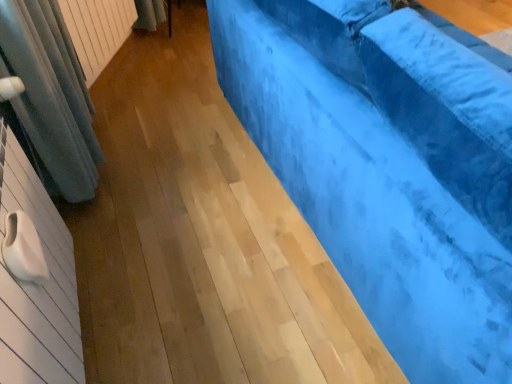
Question: Is point (79, 4) positioned closer to the camera than point (389, 317)?

Choices:
 (A) closer
 (B) farther

Answer: (B)

Question: Is white textured radiator at upper left to the left or to the right of velvet blue couch at right in the image?

Choices:
 (A) left
 (B) right

Answer: (A)

Question: Is white textured radiator at upper left taller or shorter than velvet blue couch at right?

Choices:
 (A) tall
 (B) short

Answer: (B)

Question: In terms of width, does velvet blue couch at right look wider or thinner when compared to white textured radiator at upper left?

Choices:
 (A) thin
 (B) wide

Answer: (B)

Question: From a real-world perspective, relative to white textured radiator at upper left, is velvet blue couch at right vertically above or below?

Choices:
 (A) above
 (B) below

Answer: (A)

Question: From the image's perspective, is velvet blue couch at right positioned above or below white textured radiator at upper left?

Choices:
 (A) below
 (B) above

Answer: (A)

Question: Considering their positions, is velvet blue couch at right located in front of or behind white textured radiator at upper left?

Choices:
 (A) behind
 (B) front

Answer: (B)